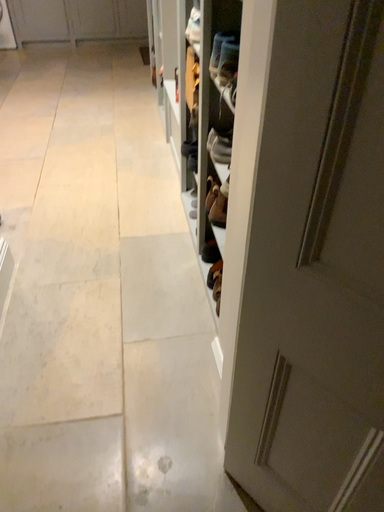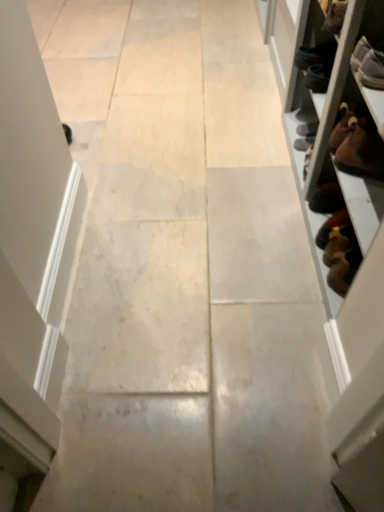
Question: How did the camera likely rotate when shooting the video?

Choices:
 (A) rotated downward
 (B) rotated upward

Answer: (A)